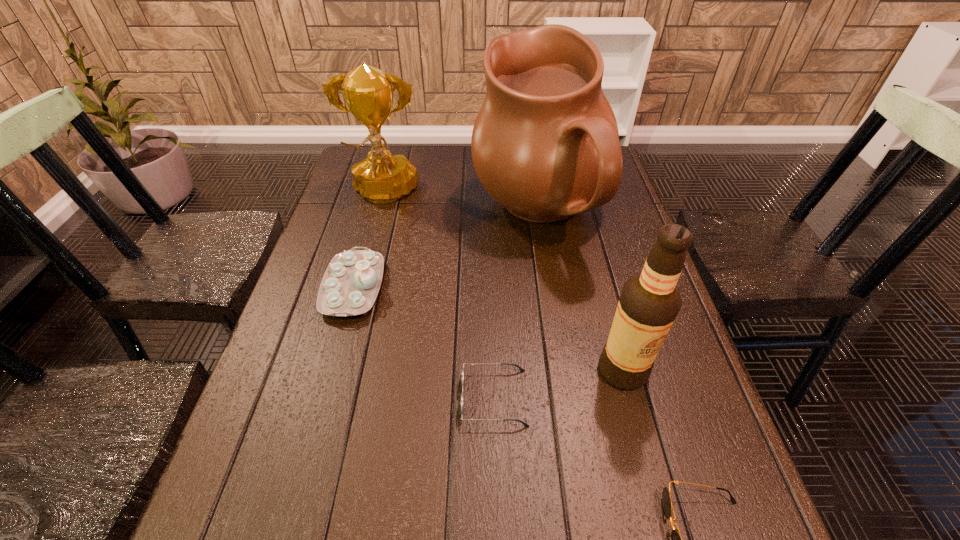
Identify the location of the tallest object. (545, 145).

This screenshot has height=540, width=960. Identify the location of award. (382, 177).

Locate an element on the screen. The width and height of the screenshot is (960, 540). alcohol is located at coordinates (650, 301).

Locate an element on the screen. The width and height of the screenshot is (960, 540). the third shortest object is located at coordinates (351, 282).

You are a GUI agent. You are given a task and a screenshot of the screen. Output one action in this format:
    pyautogui.click(x=<x>, y=<y>)
    Task: Click on the left sunglasses
    
    Given the screenshot: What is the action you would take?
    pyautogui.click(x=463, y=369)

You are a GUI agent. You are given a task and a screenshot of the screen. Output one action in this format:
    pyautogui.click(x=<x>, y=<y>)
    Task: Click on the vacant space located 0.360m at the spout of the cream pitcher
    
    Given the screenshot: What is the action you would take?
    pyautogui.click(x=348, y=214)

Where is `vacant space located 0.140m at the spout of the cream pitcher`? The width and height of the screenshot is (960, 540). vacant space located 0.140m at the spout of the cream pitcher is located at coordinates (424, 214).

I want to click on vacant area situated at the spout of the cream pitcher, so [414, 214].

Image resolution: width=960 pixels, height=540 pixels. Identify the location of vacant region located 0.150m on the front side of the award. (368, 253).

The image size is (960, 540). I want to click on vacant area located 0.080m on the label of the alcohol, so click(639, 430).